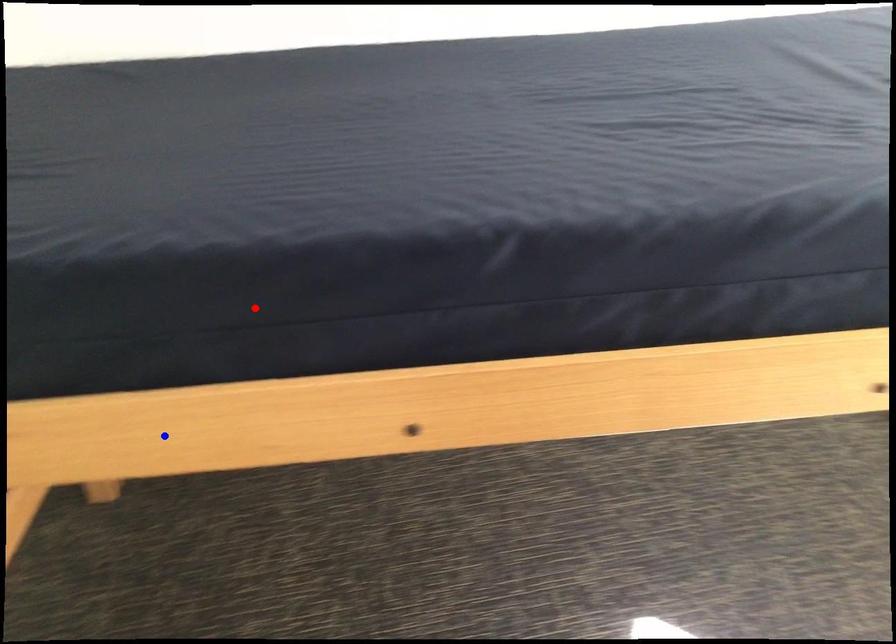
Question: In the image, two points are highlighted. Which point is nearer to the camera? Reply with the corresponding letter.

Choices:
 (A) blue point
 (B) red point

Answer: (B)